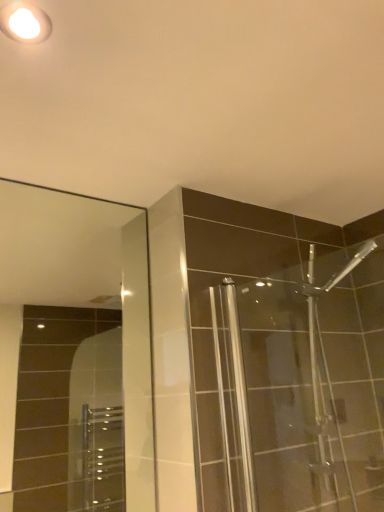
I want to click on clear glass mirror at upper left, so click(x=75, y=352).

The height and width of the screenshot is (512, 384). What do you see at coordinates (75, 352) in the screenshot?
I see `clear glass mirror at upper left` at bounding box center [75, 352].

What is the approximate height of clear glass mirror at upper left?

clear glass mirror at upper left is 34.21 inches tall.

What do you see at coordinates (25, 23) in the screenshot? I see `white glossy light fixture at upper left` at bounding box center [25, 23].

Find the location of `white glossy light fixture at upper left`. white glossy light fixture at upper left is located at coordinates (25, 23).

What is the approximate width of white glossy light fixture at upper left?

It is 3.32 inches.

Where is `clear glass mirror at upper left`? The height and width of the screenshot is (512, 384). clear glass mirror at upper left is located at coordinates (75, 352).

Between clear glass mirror at upper left and white glossy light fixture at upper left, which one appears on the left side from the viewer's perspective?

From the viewer's perspective, clear glass mirror at upper left appears more on the left side.

Which object is closer to the camera, clear glass mirror at upper left or white glossy light fixture at upper left?

white glossy light fixture at upper left.

Which is farther, (137, 268) or (7, 13)?

Positioned behind is point (137, 268).

From the image's perspective, does clear glass mirror at upper left appear lower than white glossy light fixture at upper left?

Yes, from the image's perspective, clear glass mirror at upper left is below white glossy light fixture at upper left.

From a real-world perspective, is clear glass mirror at upper left on top of white glossy light fixture at upper left?

Actually, clear glass mirror at upper left is physically below white glossy light fixture at upper left in the real world.

Between clear glass mirror at upper left and white glossy light fixture at upper left, which one has larger width?

Wider between the two is white glossy light fixture at upper left.

Can you confirm if clear glass mirror at upper left is taller than white glossy light fixture at upper left?

Correct, clear glass mirror at upper left is much taller as white glossy light fixture at upper left.

Who is bigger, clear glass mirror at upper left or white glossy light fixture at upper left?

Bigger between the two is clear glass mirror at upper left.

Does clear glass mirror at upper left contain white glossy light fixture at upper left?

No, clear glass mirror at upper left does not contain white glossy light fixture at upper left.

Based on the photo, is clear glass mirror at upper left next to white glossy light fixture at upper left and touching it?

No.

Is white glossy light fixture at upper left at the back of clear glass mirror at upper left?

No, clear glass mirror at upper left is not facing away from white glossy light fixture at upper left.

From the picture: How different are the orientations of clear glass mirror at upper left and white glossy light fixture at upper left in degrees?

The angular difference between clear glass mirror at upper left and white glossy light fixture at upper left is 7.66 degrees.

Locate an element on the screen. The image size is (384, 512). mirror below the white glossy light fixture at upper left (from the image's perspective) is located at coordinates (75, 352).

Considering the relative positions of white glossy light fixture at upper left and clear glass mirror at upper left in the image provided, is white glossy light fixture at upper left to the left of clear glass mirror at upper left from the viewer's perspective?

No, white glossy light fixture at upper left is not to the left of clear glass mirror at upper left.

Relative to clear glass mirror at upper left, is white glossy light fixture at upper left in front or behind?

Visually, white glossy light fixture at upper left is located in front of clear glass mirror at upper left.

Does point (43, 27) appear closer or farther from the camera than point (143, 288)?

Point (43, 27) is positioned closer to the camera compared to point (143, 288).

Looking at this image, from the image's perspective, is white glossy light fixture at upper left on clear glass mirror at upper left?

Yes, from the image's perspective, white glossy light fixture at upper left is on top of clear glass mirror at upper left.

From a real-world perspective, is white glossy light fixture at upper left above or below clear glass mirror at upper left?

From a real-world perspective, white glossy light fixture at upper left is physically above clear glass mirror at upper left.

Is white glossy light fixture at upper left wider than clear glass mirror at upper left?

Yes.

Which of these two, white glossy light fixture at upper left or clear glass mirror at upper left, stands taller?

clear glass mirror at upper left.

From the picture: Which of these two, white glossy light fixture at upper left or clear glass mirror at upper left, is smaller?

Smaller between the two is white glossy light fixture at upper left.

Is clear glass mirror at upper left located within white glossy light fixture at upper left?

No, clear glass mirror at upper left is not surrounded by white glossy light fixture at upper left.

Is white glossy light fixture at upper left not close to clear glass mirror at upper left?

Absolutely, white glossy light fixture at upper left is distant from clear glass mirror at upper left.

Is white glossy light fixture at upper left facing towards clear glass mirror at upper left?

No, white glossy light fixture at upper left is not facing towards clear glass mirror at upper left.

Find the location of `light fixture above the clear glass mirror at upper left (from the image's perspective)`. light fixture above the clear glass mirror at upper left (from the image's perspective) is located at coordinates (25, 23).

Where is `light fixture that is above the clear glass mirror at upper left (from the image's perspective)`? light fixture that is above the clear glass mirror at upper left (from the image's perspective) is located at coordinates (25, 23).

Where is `mirror below the white glossy light fixture at upper left (from a real-world perspective)`? mirror below the white glossy light fixture at upper left (from a real-world perspective) is located at coordinates (75, 352).